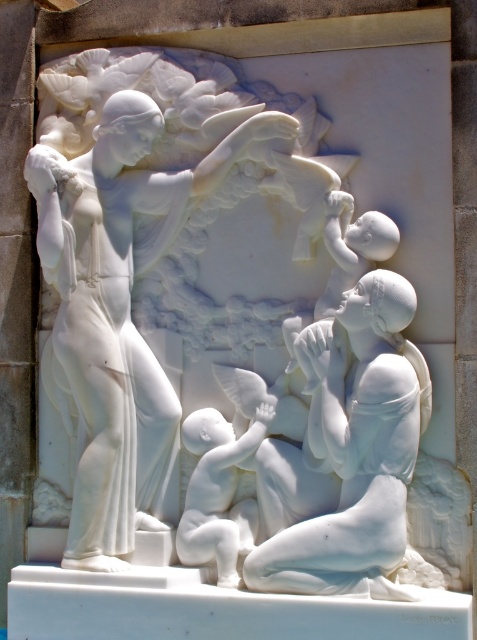
Which is below, white marble statue at center or matte white baby at lower center?

matte white baby at lower center

Can you confirm if white marble statue at center is thinner than matte white baby at lower center?

No.

Does point (331, 374) come behind point (204, 461)?

No, (331, 374) is closer to viewer.

This screenshot has height=640, width=477. In order to click on white marble statue at center in this screenshot , I will do `click(345, 456)`.